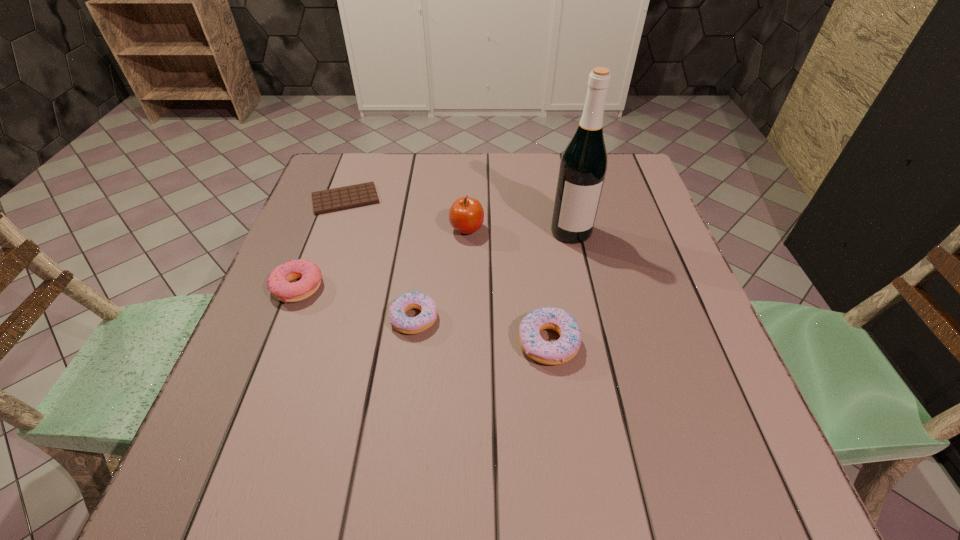
At what (x,y) coordinates should I click in order to perform the action: click on vacant spot to place a doughnut on the right. Please return your answer as a coordinate pair (x, y). This screenshot has height=540, width=960. Looking at the image, I should click on (697, 367).